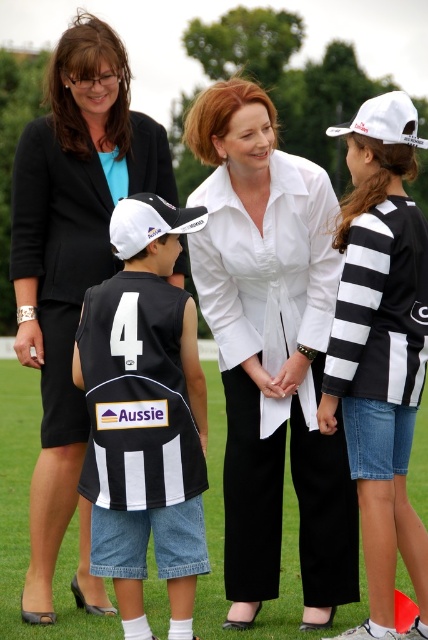
Who is higher up, black jersey at center or white matte baseball cap at center-left?

Positioned higher is white matte baseball cap at center-left.

Can you confirm if black jersey at center is positioned to the left of white matte baseball cap at center-left?

In fact, black jersey at center is to the right of white matte baseball cap at center-left.

Does point (98, 344) lie behind point (174, 212)?

No, (98, 344) is in front of (174, 212).

Find the location of `black jersey at center`. black jersey at center is located at coordinates (145, 416).

Between black and white striped shirt at right and white matte baseball cap at center-left, which one has more height?

black and white striped shirt at right is taller.

Is black and white striped shirt at right to the right of white matte baseball cap at center-left from the viewer's perspective?

Yes, black and white striped shirt at right is to the right of white matte baseball cap at center-left.

Is point (383, 593) farther from viewer compared to point (127, 228)?

No, (383, 593) is in front of (127, 228).

Where is `black and white striped shirt at right`? black and white striped shirt at right is located at coordinates (380, 349).

Between white smooth shirt at center and black and white striped shirt at right, which one has more height?

With more height is black and white striped shirt at right.

Consider the image. Is white smooth shirt at center below black and white striped shirt at right?

Yes, white smooth shirt at center is below black and white striped shirt at right.

Between point (202, 148) and point (401, 525), which one is positioned in front?

Point (401, 525) is in front.

Locate an element on the screen. white smooth shirt at center is located at coordinates (270, 352).